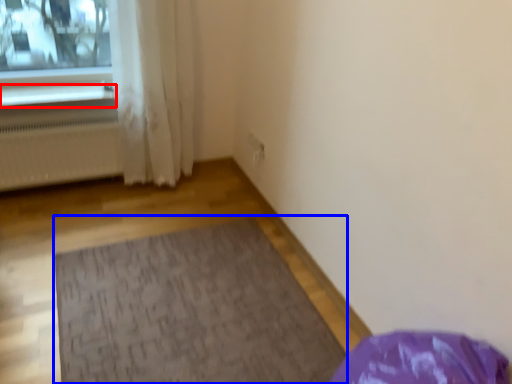
Question: Which point is closer to the camera, window sill (highlighted by a red box) or mat (highlighted by a blue box)?

Choices:
 (A) window sill
 (B) mat

Answer: (B)